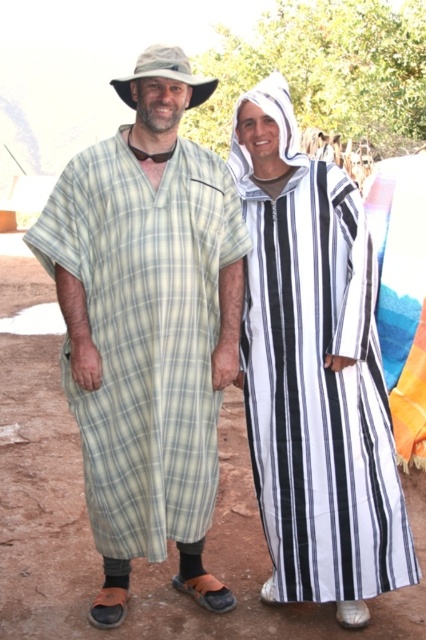
You are standing at the origin point of the coordinate system in the image. There is a light green plaid robe at center located at point (147, 326). If you move 0.1 units to the right along the x axis, will you be closer to or farther from the light green plaid robe at center?

Moving 0.1 units to the right along the x axis from the origin point would take you to 0.1, 0. Since the light green plaid robe at center is at (147, 326), you would be closer to it because the distance decreases along the x axis.

You are a photographer trying to capture both the light green plaid robe at center and the white striped robe at center in a single photo. Since you want both robes to be clearly visible, which robe should you focus on first to ensure the background robe is still in focus?

The light green plaid robe at center is in front of the white striped robe at center, so you should focus on the light green plaid robe at center first to ensure the white striped robe at center in the background remains in focus.

You are a photographer trying to capture a clear photo of the camouflage fabric cowboy hat at upper center and the light green plaid robe at center. Since the robe is blocking part of the hat, will you need to adjust your camera angle to get both fully visible?

The light green plaid robe at center is located below the camouflage fabric cowboy hat at upper center, so adjusting the camera angle downward might help capture both fully without obstruction.